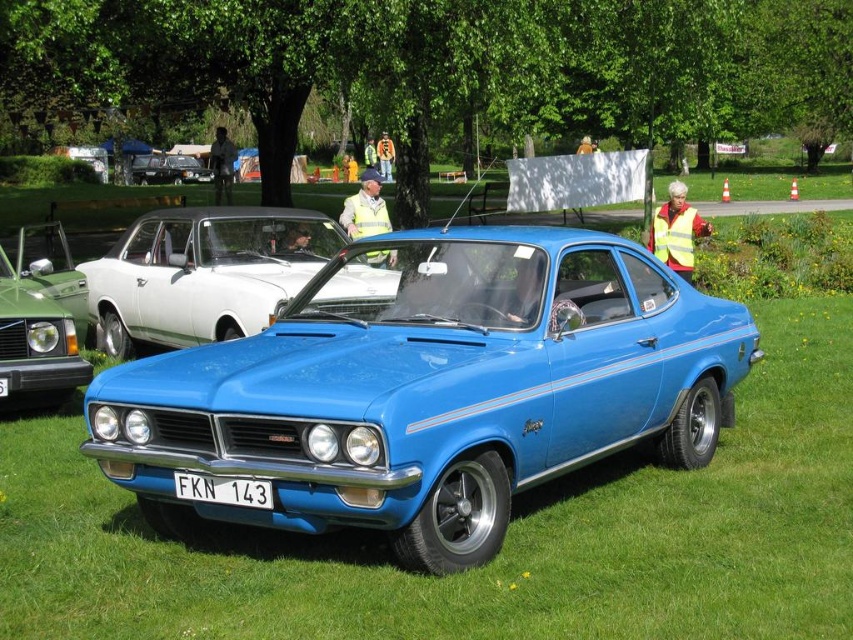
Question: Does glossy blue car at center have a greater width compared to blue glossy car at center?

Choices:
 (A) no
 (B) yes

Answer: (B)

Question: Is the position of glossy blue car at center more distant than that of shiny black car at center?

Choices:
 (A) no
 (B) yes

Answer: (A)

Question: Which object appears closest to the camera in this image?

Choices:
 (A) white plastic license plate at center
 (B) blue glossy car at center
 (C) glossy blue car at center
 (D) shiny black car at center

Answer: (C)

Question: Which point is farther to the camera?

Choices:
 (A) blue glossy car at center
 (B) white plastic license plate at center
 (C) glossy blue car at center
 (D) green matte car at left

Answer: (A)

Question: Can you confirm if glossy blue car at center is smaller than white plastic license plate at center?

Choices:
 (A) yes
 (B) no

Answer: (B)

Question: Which object appears closest to the camera in this image?

Choices:
 (A) shiny black car at center
 (B) blue glossy car at center

Answer: (B)